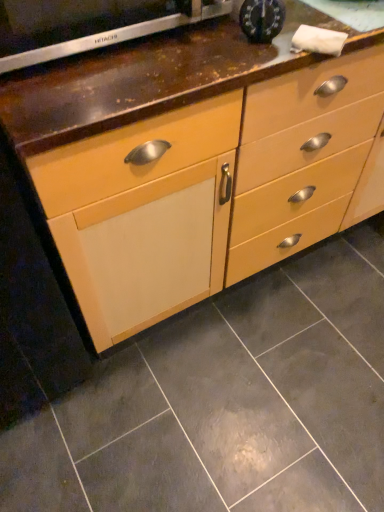
Identify the location of vacant space in between satin silver oven at upper left, marked as the first appliance in a left-to-right arrangement, and metallic clock at upper center, which ranks as the 1th appliance in right-to-left order. (168, 59).